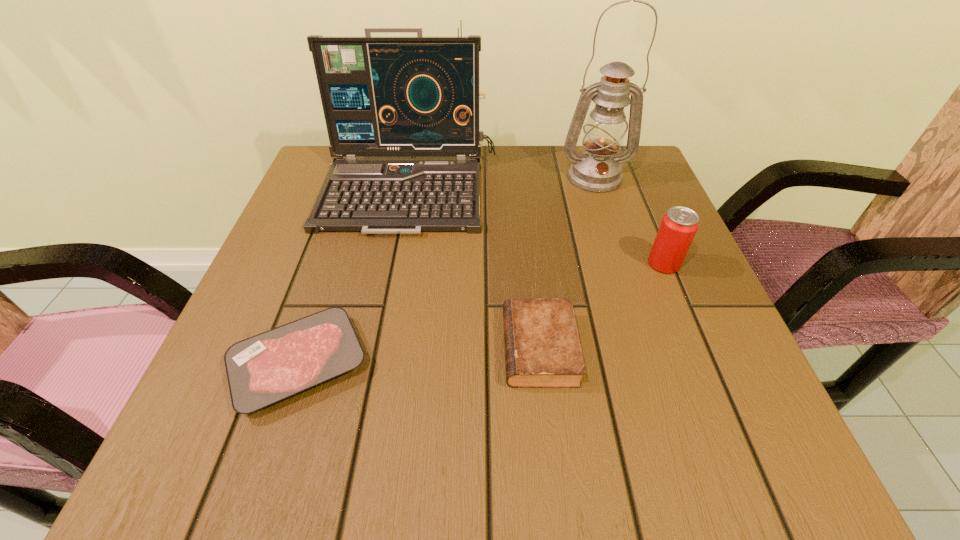
At what (x,y) coordinates should I click in order to perform the action: click on free space located on the spine side of the diary. Please return your answer as a coordinate pair (x, y). The width and height of the screenshot is (960, 540). Looking at the image, I should click on (312, 348).

You are a GUI agent. You are given a task and a screenshot of the screen. Output one action in this format:
    pyautogui.click(x=<x>, y=<y>)
    Task: Click on the vacant space located 0.340m on the spine side of the diary
    The width and height of the screenshot is (960, 540).
    Given the screenshot: What is the action you would take?
    pyautogui.click(x=300, y=348)

This screenshot has height=540, width=960. I want to click on vacant area situated 0.360m on the spine side of the diary, so click(x=288, y=348).

I want to click on vacant space located 0.110m on the right of the shortest object, so click(436, 364).

Identify the location of oil lamp present at the far edge. (598, 170).

I want to click on laptop computer located at the far edge, so click(381, 96).

In order to click on object that is at the near edge in this screenshot , I will do `click(264, 369)`.

Find the location of a particular element. The height and width of the screenshot is (540, 960). laptop computer at the left edge is located at coordinates (381, 96).

At what (x,y) coordinates should I click in order to perform the action: click on steak situated at the left edge. Please return your answer as a coordinate pair (x, y). The height and width of the screenshot is (540, 960). Looking at the image, I should click on (264, 369).

Find the location of a particular element. The width and height of the screenshot is (960, 540). oil lamp at the right edge is located at coordinates (598, 170).